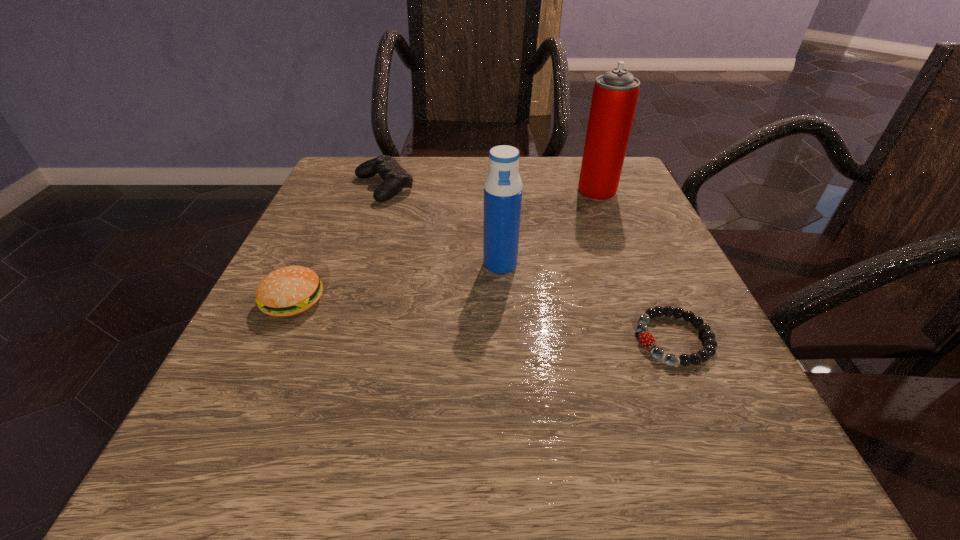
This screenshot has height=540, width=960. What are the coordinates of `vacant space at the near edge` in the screenshot? It's located at (543, 483).

This screenshot has width=960, height=540. In the image, there is a desktop. Find the location of `vacant area at the left edge`. vacant area at the left edge is located at coordinates (301, 403).

I want to click on free space at the right edge of the desktop, so click(709, 361).

In the image, there is a desktop. At what (x,y) coordinates should I click in order to perform the action: click on vacant space at the far left corner. Please return your answer as a coordinate pair (x, y). Image resolution: width=960 pixels, height=540 pixels. Looking at the image, I should click on (340, 191).

Locate an element on the screen. This screenshot has height=540, width=960. vacant space at the near left corner of the desktop is located at coordinates (242, 440).

This screenshot has height=540, width=960. I want to click on vacant space at the far right corner, so click(574, 169).

Identify the location of unoccupied area between the third object from right to left and the shortest object. This screenshot has height=540, width=960. (587, 301).

The height and width of the screenshot is (540, 960). Identify the location of vacant region between the control and the patty. (339, 244).

The height and width of the screenshot is (540, 960). Identify the location of unoccupied area between the second tallest object and the patty. (396, 282).

Where is `vacant space that's between the fourth shortest object and the control`? Image resolution: width=960 pixels, height=540 pixels. vacant space that's between the fourth shortest object and the control is located at coordinates (442, 225).